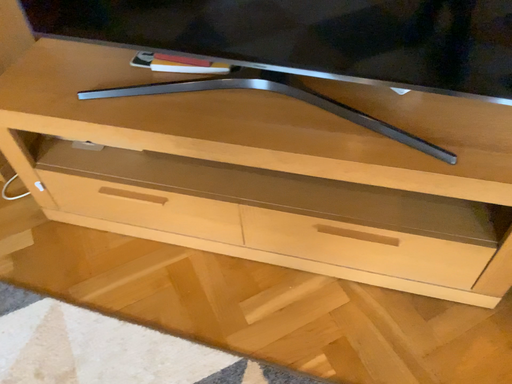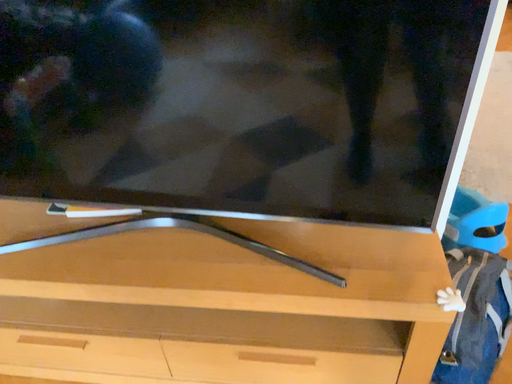
Question: How did the camera likely rotate when shooting the video?

Choices:
 (A) rotated upward
 (B) rotated downward

Answer: (A)